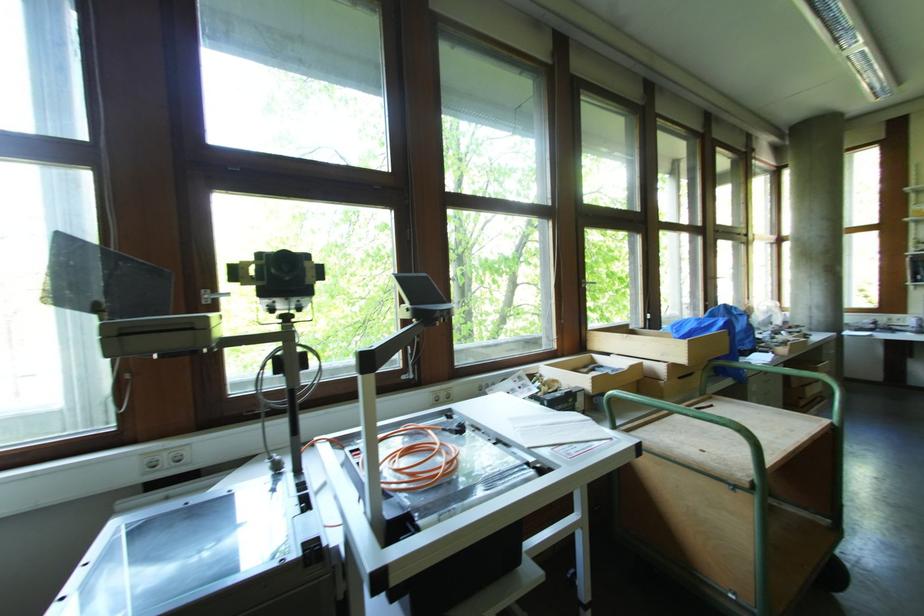
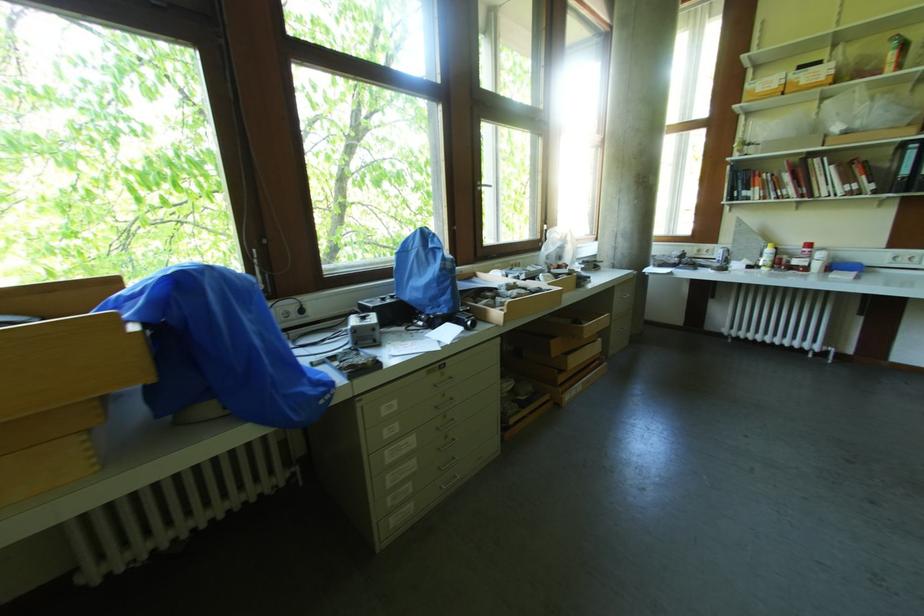
In a continuous first-person perspective shot, in which direction is the camera moving?

The cameraman walked toward right, forward.